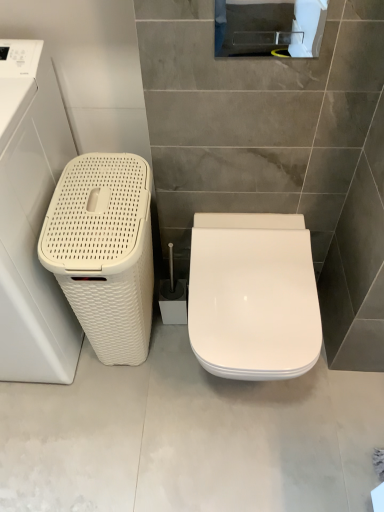
Question: Considering the relative positions of white glossy toilet seat at center and white woven basket at left in the image provided, is white glossy toilet seat at center to the right of white woven basket at left from the viewer's perspective?

Choices:
 (A) yes
 (B) no

Answer: (A)

Question: Is white glossy toilet seat at center not close to white woven basket at left?

Choices:
 (A) no
 (B) yes

Answer: (A)

Question: Is white glossy toilet seat at center to the left of white woven basket at left from the viewer's perspective?

Choices:
 (A) no
 (B) yes

Answer: (A)

Question: Is white glossy toilet seat at center looking in the opposite direction of white woven basket at left?

Choices:
 (A) no
 (B) yes

Answer: (A)

Question: From a real-world perspective, is white glossy toilet seat at center positioned over white woven basket at left based on gravity?

Choices:
 (A) yes
 (B) no

Answer: (B)

Question: Does white glossy toilet seat at center have a greater height compared to white woven basket at left?

Choices:
 (A) no
 (B) yes

Answer: (A)

Question: From a real-world perspective, is white glossy toilet at center on top of white woven basket at left?

Choices:
 (A) no
 (B) yes

Answer: (A)

Question: From a real-world perspective, is white glossy toilet at center physically below white woven basket at left?

Choices:
 (A) yes
 (B) no

Answer: (A)

Question: Considering the relative sizes of white glossy toilet at center and white woven basket at left in the image provided, is white glossy toilet at center bigger than white woven basket at left?

Choices:
 (A) no
 (B) yes

Answer: (A)

Question: Is white glossy toilet at center thinner than white woven basket at left?

Choices:
 (A) no
 (B) yes

Answer: (A)

Question: Is white glossy toilet at center positioned before white woven basket at left?

Choices:
 (A) yes
 (B) no

Answer: (B)

Question: Does white glossy toilet at center turn towards white woven basket at left?

Choices:
 (A) no
 (B) yes

Answer: (A)

Question: From a real-world perspective, is white woven basket at left positioned over white glossy toilet seat at center based on gravity?

Choices:
 (A) no
 (B) yes

Answer: (B)